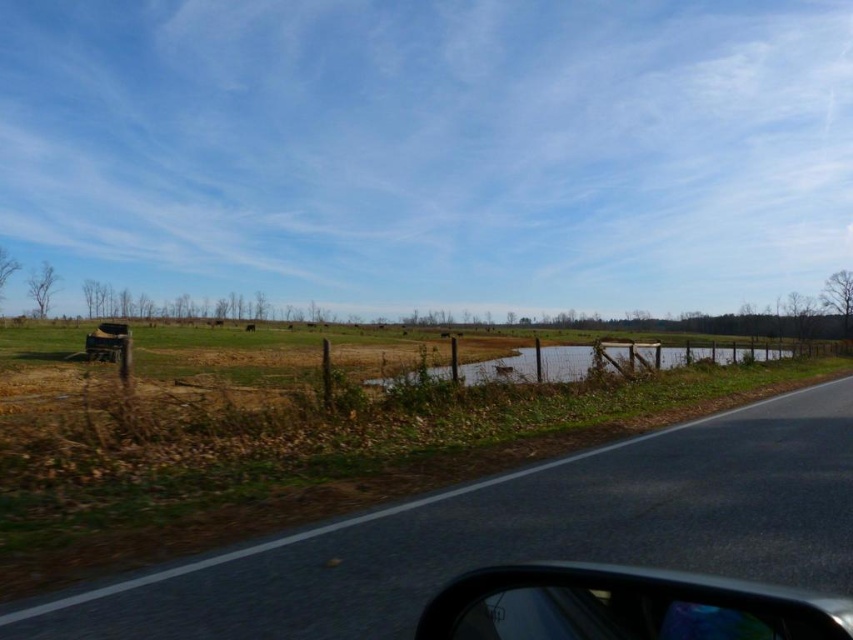
Question: In this image, where is asphalt road at lower right located relative to brushed metal jeep at lower left?

Choices:
 (A) below
 (B) above

Answer: (A)

Question: Which is nearer to the brushed metal jeep at lower left?

Choices:
 (A) glossy plastic car at lower right
 (B) asphalt road at lower right
 (C) brown grassy flood at center

Answer: (C)

Question: Does glossy plastic car at lower right have a lesser width compared to brushed metal jeep at lower left?

Choices:
 (A) yes
 (B) no

Answer: (B)

Question: Estimate the real-world distances between objects in this image. Which object is farther from the glossy plastic car at lower right?

Choices:
 (A) brushed metal jeep at lower left
 (B) brown grassy flood at center
 (C) asphalt road at lower right

Answer: (A)

Question: Is asphalt road at lower right below brushed metal jeep at lower left?

Choices:
 (A) yes
 (B) no

Answer: (A)

Question: Which object appears closest to the camera in this image?

Choices:
 (A) glossy plastic car at lower right
 (B) asphalt road at lower right
 (C) brushed metal jeep at lower left

Answer: (A)